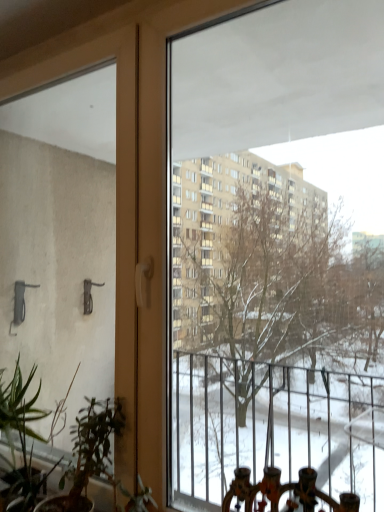
Question: Which is correct: green matte plant at lower left is inside green matte plant at lower left, or outside of it?

Choices:
 (A) outside
 (B) inside

Answer: (B)

Question: Would you say green matte plant at lower left is to the left or to the right of green matte plant at lower left in the picture?

Choices:
 (A) left
 (B) right

Answer: (A)

Question: Is point (29, 497) positioned closer to the camera than point (69, 475)?

Choices:
 (A) farther
 (B) closer

Answer: (B)

Question: Is green matte plant at lower left in front of or behind green matte plant at lower left in the image?

Choices:
 (A) front
 (B) behind

Answer: (A)

Question: Is green matte plant at lower left inside or outside of green matte plant at lower left?

Choices:
 (A) outside
 (B) inside

Answer: (A)

Question: Considering the positions of green matte plant at lower left and green matte plant at lower left in the image, is green matte plant at lower left taller or shorter than green matte plant at lower left?

Choices:
 (A) tall
 (B) short

Answer: (B)

Question: Considering the positions of green matte plant at lower left and green matte plant at lower left in the image, is green matte plant at lower left wider or thinner than green matte plant at lower left?

Choices:
 (A) wide
 (B) thin

Answer: (A)